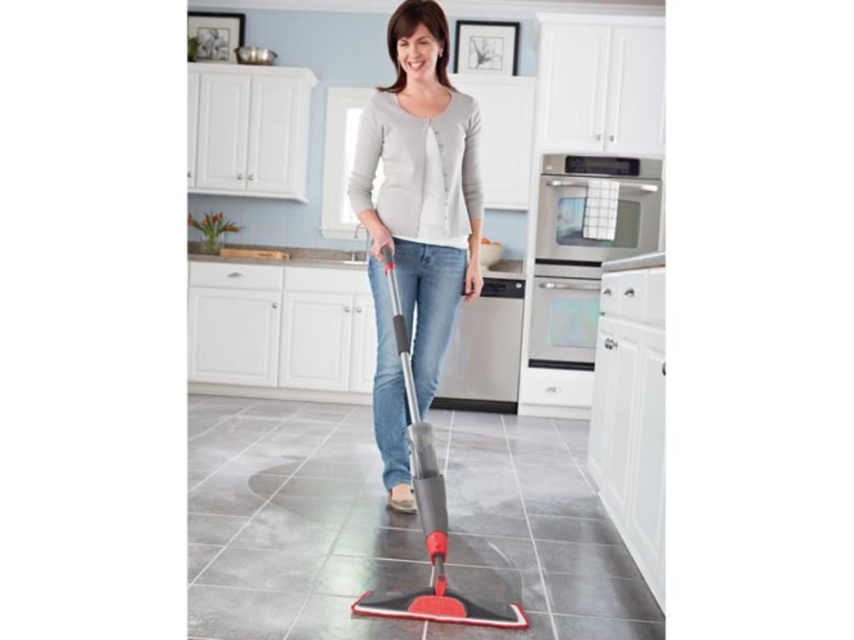
Is gray matte sweater at center behind red rubber mop at center?

Yes, gray matte sweater at center is further from the viewer.

Is point (442, 138) closer to viewer compared to point (399, 595)?

No, it is not.

Locate an element on the screen. gray matte sweater at center is located at coordinates (416, 218).